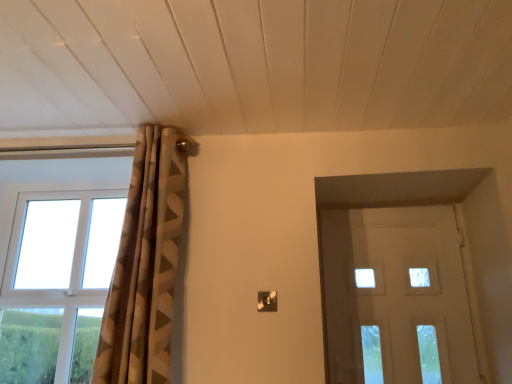
Question: Considering the relative sizes of brown textured curtain at upper left and white plastic window at left in the image provided, is brown textured curtain at upper left bigger than white plastic window at left?

Choices:
 (A) yes
 (B) no

Answer: (A)

Question: Is brown textured curtain at upper left thinner than white plastic window at left?

Choices:
 (A) no
 (B) yes

Answer: (A)

Question: Considering the relative sizes of brown textured curtain at upper left and white plastic window at left in the image provided, is brown textured curtain at upper left shorter than white plastic window at left?

Choices:
 (A) no
 (B) yes

Answer: (A)

Question: Is brown textured curtain at upper left in contact with white plastic window at left?

Choices:
 (A) no
 (B) yes

Answer: (A)

Question: From a real-world perspective, is brown textured curtain at upper left below white plastic window at left?

Choices:
 (A) no
 (B) yes

Answer: (A)

Question: In terms of height, does white frosted glass door at right look taller or shorter compared to white plastic window at left?

Choices:
 (A) short
 (B) tall

Answer: (A)

Question: Based on their positions, is white frosted glass door at right located to the left or right of white plastic window at left?

Choices:
 (A) right
 (B) left

Answer: (A)

Question: From the image's perspective, is white frosted glass door at right located above or below white plastic window at left?

Choices:
 (A) below
 (B) above

Answer: (A)

Question: Considering the positions of point coord(451,337) and point coord(25,357), is point coord(451,337) closer or farther from the camera than point coord(25,357)?

Choices:
 (A) closer
 (B) farther

Answer: (A)

Question: Is white frosted glass door at right bigger or smaller than brown textured curtain at upper left?

Choices:
 (A) small
 (B) big

Answer: (A)

Question: Relative to brown textured curtain at upper left, is white frosted glass door at right in front or behind?

Choices:
 (A) front
 (B) behind

Answer: (B)

Question: Is white frosted glass door at right spatially inside brown textured curtain at upper left, or outside of it?

Choices:
 (A) outside
 (B) inside

Answer: (A)

Question: From the image's perspective, is white frosted glass door at right located above or below brown textured curtain at upper left?

Choices:
 (A) below
 (B) above

Answer: (A)

Question: Considering their positions, is white plastic window at left located in front of or behind white frosted glass door at right?

Choices:
 (A) behind
 (B) front

Answer: (A)

Question: In terms of size, does white plastic window at left appear bigger or smaller than white frosted glass door at right?

Choices:
 (A) small
 (B) big

Answer: (B)